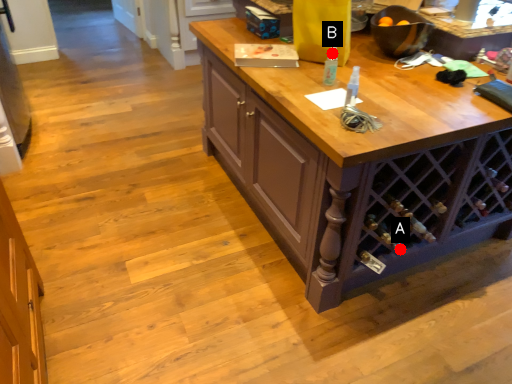
Question: Two points are circled on the image, labeled by A and B beside each circle. Which point is closer to the camera?

Choices:
 (A) A is closer
 (B) B is closer

Answer: (B)